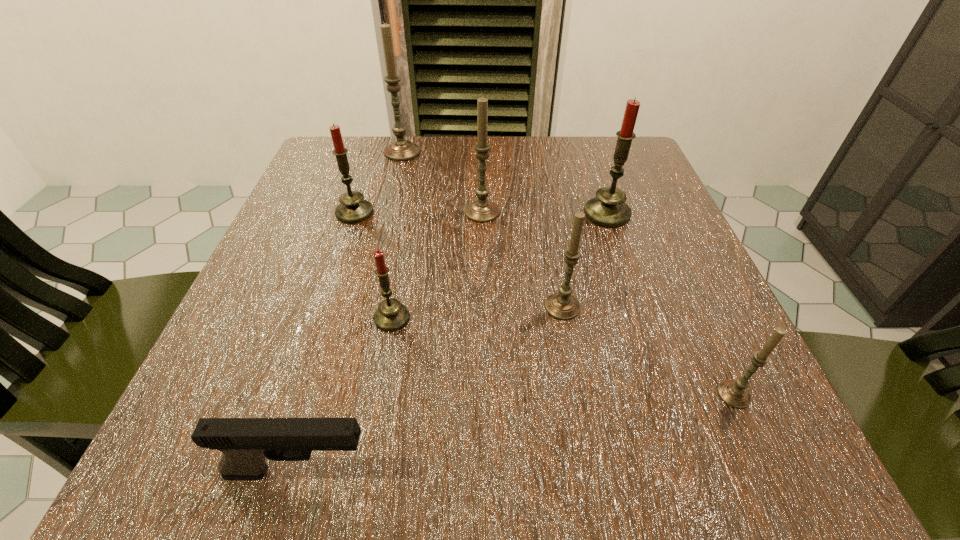
This screenshot has height=540, width=960. I want to click on the farthest candle, so click(400, 150).

Locate an element on the screen. This screenshot has width=960, height=540. the tallest object is located at coordinates (x=400, y=150).

This screenshot has width=960, height=540. What are the coordinates of `the biggest red candle` in the screenshot? It's located at (608, 209).

This screenshot has height=540, width=960. Identify the location of the rightmost red candle. (608, 209).

This screenshot has height=540, width=960. Find the location of `the second gray candle from left to right`. the second gray candle from left to right is located at coordinates (481, 210).

Find the location of a particular element. The width and height of the screenshot is (960, 540). the fourth candle from left to right is located at coordinates (481, 210).

Where is `the leftmost red candle`? the leftmost red candle is located at coordinates (353, 209).

At what (x,y) coordinates should I click in order to perform the action: click on the second smallest gray candle. Please return your answer as a coordinate pair (x, y). The width and height of the screenshot is (960, 540). Looking at the image, I should click on (562, 305).

Where is `the second gray candle from right to left`? The height and width of the screenshot is (540, 960). the second gray candle from right to left is located at coordinates (562, 305).

I want to click on the nearest red candle, so click(x=391, y=315).